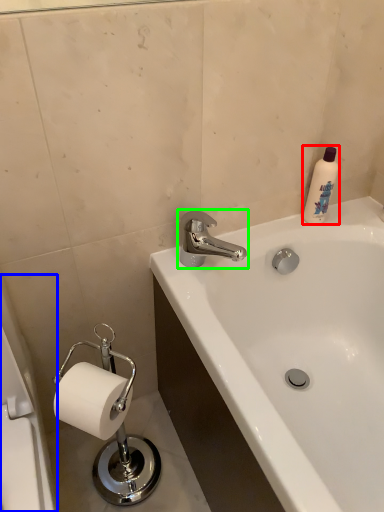
Question: Considering the real-world distances, which object is closest to cleaning product (highlighted by a red box)? bath (highlighted by a blue box) or tap (highlighted by a green box).

Choices:
 (A) bath
 (B) tap

Answer: (B)